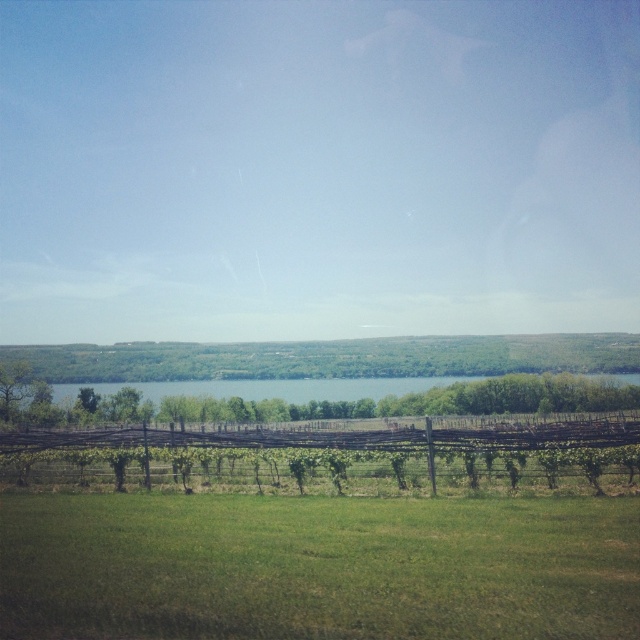
Question: Which point is farther to the camera?

Choices:
 (A) green grassy field at lower center
 (B) brown wooden fence at center

Answer: (B)

Question: Which of the following is the closest to the observer?

Choices:
 (A) (280, 426)
 (B) (45, 588)

Answer: (B)

Question: Can you confirm if green grassy field at lower center is positioned above brown wooden fence at center?

Choices:
 (A) no
 (B) yes

Answer: (B)

Question: Is green grassy field at lower center wider than brown wooden fence at center?

Choices:
 (A) yes
 (B) no

Answer: (B)

Question: Can you confirm if green grassy field at lower center is bigger than brown wooden fence at center?

Choices:
 (A) yes
 (B) no

Answer: (B)